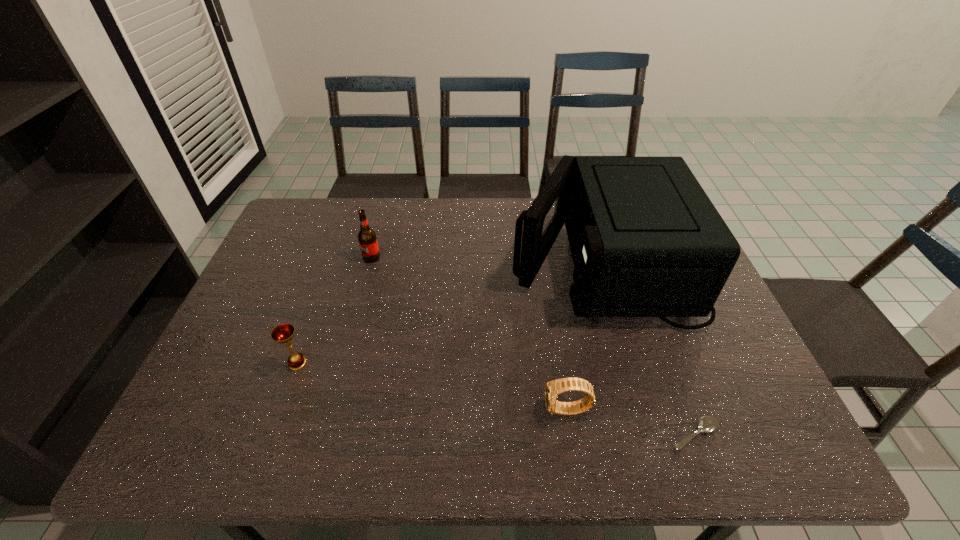
Identify the location of the tallest object. The height and width of the screenshot is (540, 960). (646, 241).

Locate an element on the screen. This screenshot has height=540, width=960. the fourth object from right to left is located at coordinates (367, 239).

I want to click on root beer, so click(x=367, y=239).

The height and width of the screenshot is (540, 960). In order to click on the leftmost object in this screenshot , I will do `click(283, 333)`.

Identify the location of chalice. (283, 333).

What are the coordinates of `the second shortest object` in the screenshot? It's located at (553, 388).

Identify the location of the shortest object. Image resolution: width=960 pixels, height=540 pixels. (707, 424).

You are a GUI agent. You are given a task and a screenshot of the screen. Output one action in this format:
    pyautogui.click(x=<x>, y=<y>)
    Task: Click on the free region located with the door open on the microwave oven
    
    Given the screenshot: What is the action you would take?
    pyautogui.click(x=461, y=261)

The image size is (960, 540). I want to click on vacant region located 0.160m with the door open on the microwave oven, so click(x=458, y=261).

The image size is (960, 540). In order to click on vacant space located 0.060m with the door open on the microwave oven in this screenshot , I will do `click(491, 261)`.